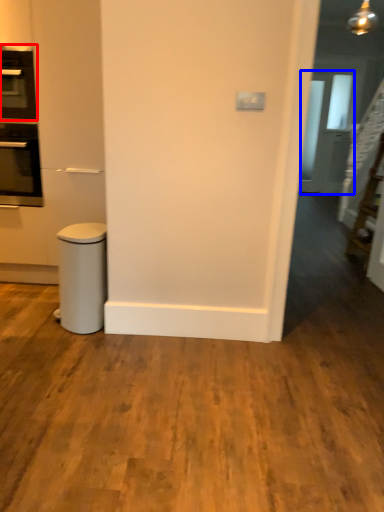
Question: Which of the following is the closest to the observer, home appliance (highlighted by a red box) or glass door (highlighted by a blue box)?

Choices:
 (A) home appliance
 (B) glass door

Answer: (A)